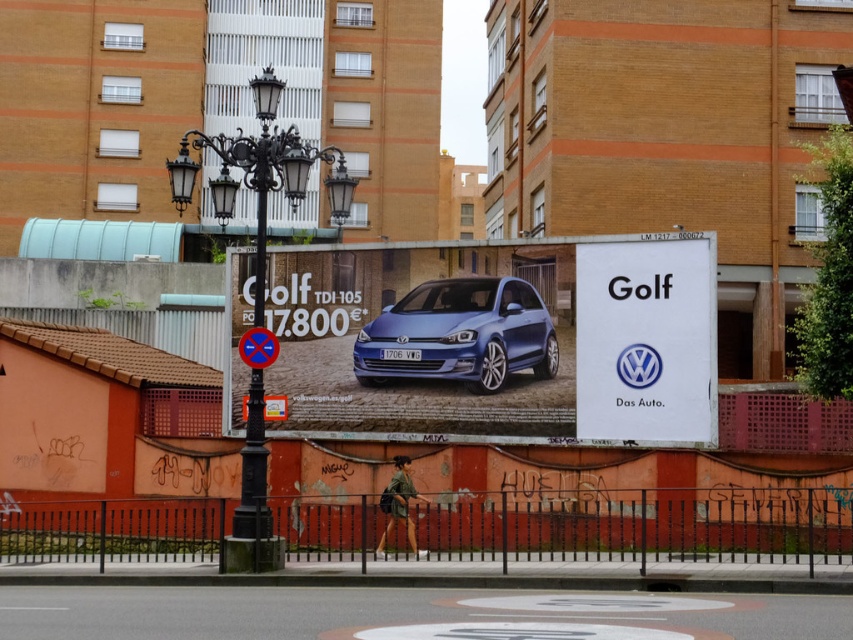
Question: Which object is closer to the camera taking this photo?

Choices:
 (A) satin blue car at center
 (B) metallic blue car at center

Answer: (A)

Question: Considering the relative positions of black wrought iron lamp post at center and metallic reflective no parking sign at center in the image provided, where is black wrought iron lamp post at center located with respect to metallic reflective no parking sign at center?

Choices:
 (A) right
 (B) left

Answer: (B)

Question: Does metallic blue car at center have a larger size compared to white paperboard at center?

Choices:
 (A) yes
 (B) no

Answer: (B)

Question: Is metallic blue car at center in front of black wrought iron lamp post at center?

Choices:
 (A) yes
 (B) no

Answer: (B)

Question: Which of the following is the farthest from the observer?

Choices:
 (A) satin blue car at center
 (B) metallic blue car at center
 (C) white paperboard at center

Answer: (B)

Question: Which point appears farthest from the camera in this image?

Choices:
 (A) (584, 269)
 (B) (264, 118)
 (C) (248, 355)
 (D) (471, 316)

Answer: (D)